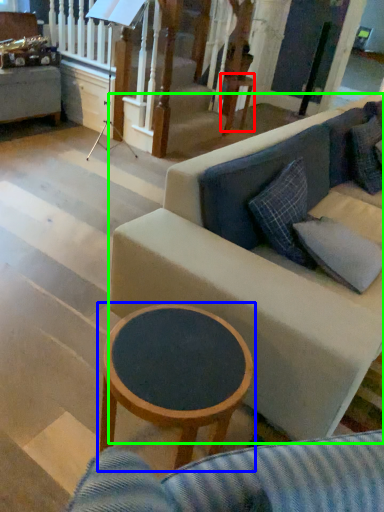
Question: Which object is positioned closest to table (highlighted by a red box)? Select from coffee table (highlighted by a blue box) and studio couch (highlighted by a green box).

Choices:
 (A) coffee table
 (B) studio couch

Answer: (B)